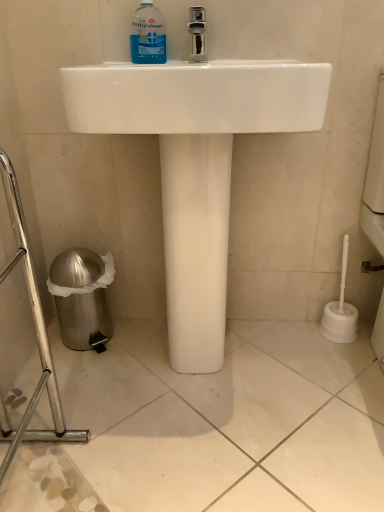
Question: Visually, is blue transparent liquid at upper center positioned to the left or to the right of white glossy sink at center?

Choices:
 (A) left
 (B) right

Answer: (A)

Question: Is blue transparent liquid at upper center situated inside white glossy sink at center or outside?

Choices:
 (A) inside
 (B) outside

Answer: (A)

Question: Based on their sizes in the image, would you say blue transparent liquid at upper center is bigger or smaller than white glossy sink at center?

Choices:
 (A) small
 (B) big

Answer: (A)

Question: Would you say white glossy sink at center is to the left or to the right of blue transparent liquid at upper center in the picture?

Choices:
 (A) left
 (B) right

Answer: (B)

Question: From their relative heights in the image, would you say white glossy sink at center is taller or shorter than blue transparent liquid at upper center?

Choices:
 (A) short
 (B) tall

Answer: (B)

Question: Is white glossy sink at center inside the boundaries of blue transparent liquid at upper center, or outside?

Choices:
 (A) inside
 (B) outside

Answer: (B)

Question: Relative to blue transparent liquid at upper center, is white glossy sink at center in front or behind?

Choices:
 (A) behind
 (B) front

Answer: (B)